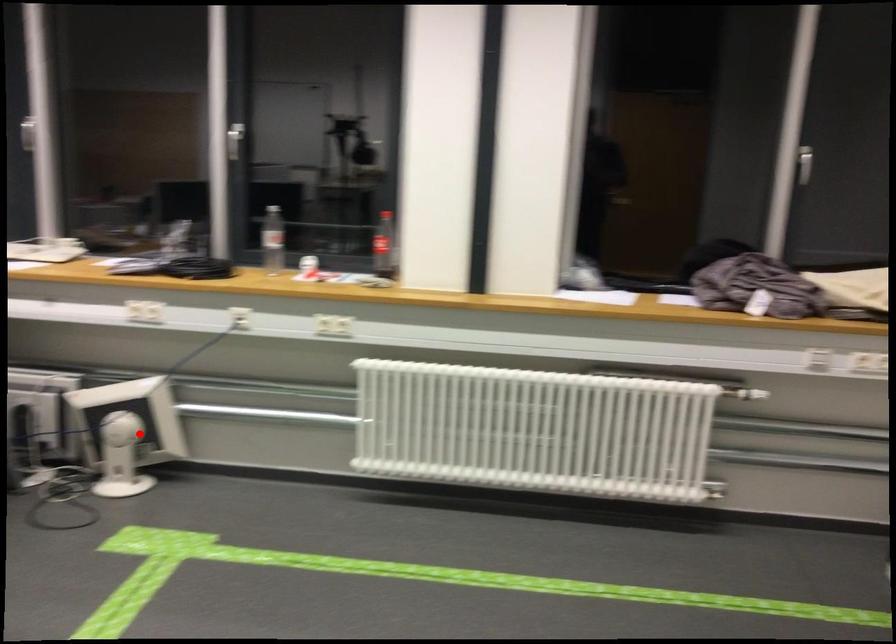
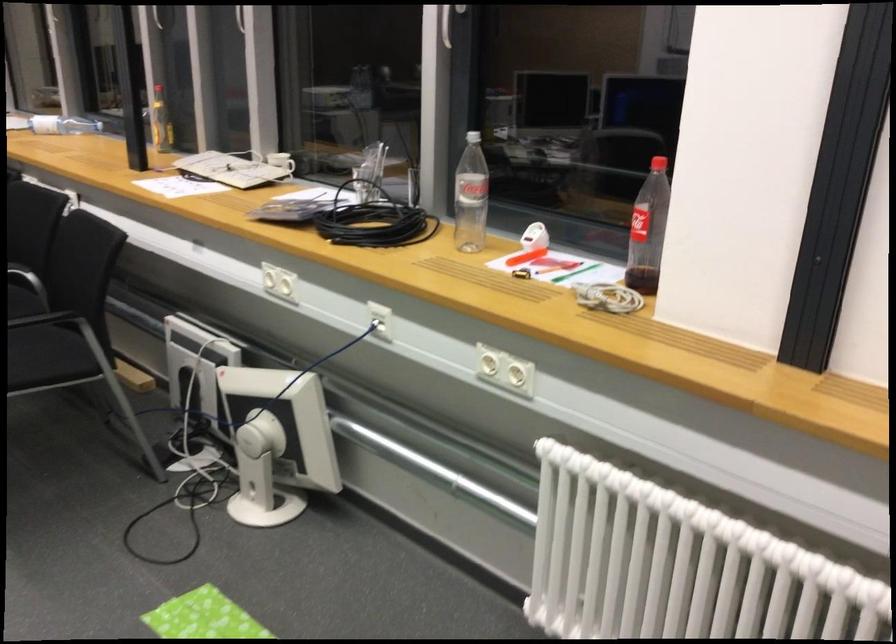
Find the pixel in the second image that matches the highlighted location in the first image.

(277, 442)